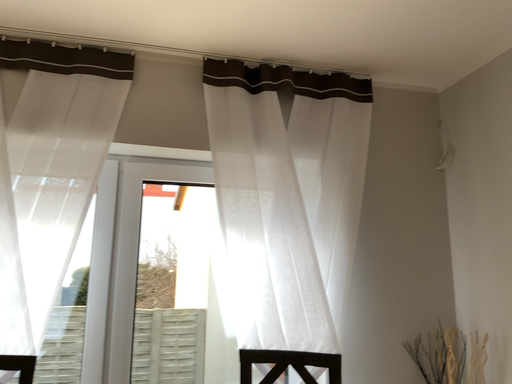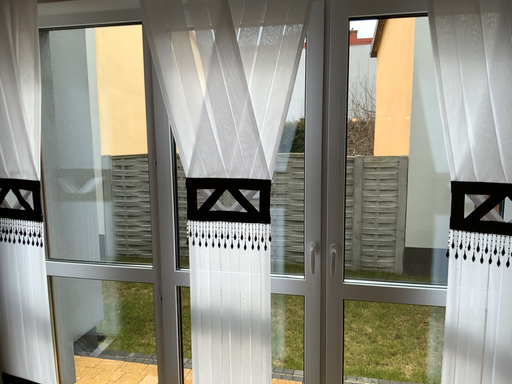
Question: How did the camera likely rotate when shooting the video?

Choices:
 (A) rotated right
 (B) rotated left

Answer: (B)